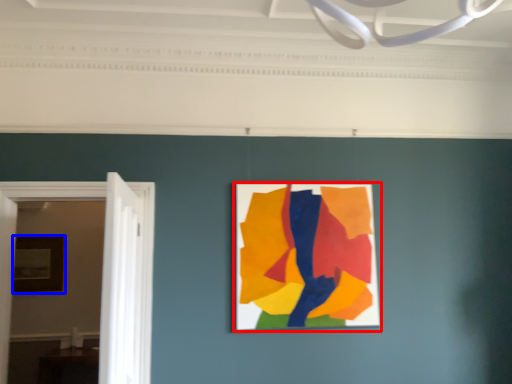
Question: Which object is closer to the camera taking this photo, picture frame (highlighted by a red box) or picture frame (highlighted by a blue box)?

Choices:
 (A) picture frame
 (B) picture frame

Answer: (A)